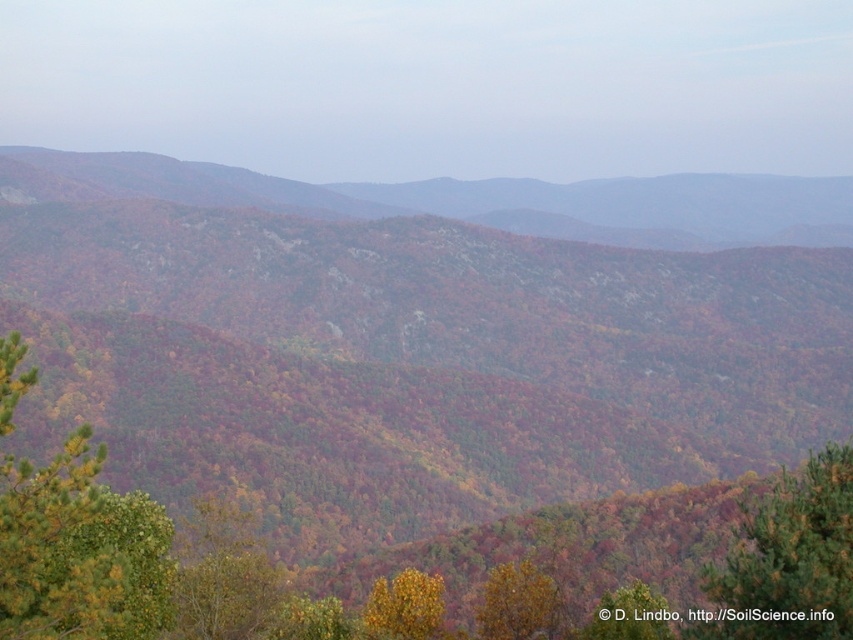
Does golden yellow pine at left have a lesser width compared to yellow matte tree at lower center?

Yes, golden yellow pine at left is thinner than yellow matte tree at lower center.

Who is more distant from viewer, (20, 524) or (367, 612)?

Point (367, 612)

At what (x,y) coordinates should I click in order to perform the action: click on golden yellow pine at left. Please return your answer as a coordinate pair (x, y). Looking at the image, I should click on (56, 548).

Who is positioned more to the right, green matte tree at lower right or green leafy tree at center?

green leafy tree at center is more to the right.

Is green matte tree at lower right to the right of green leafy tree at center from the viewer's perspective?

No, green matte tree at lower right is not to the right of green leafy tree at center.

Identify the location of green matte tree at lower right. coord(788,560).

Which is below, yellow matte tree at lower center or green leafy tree at center?

yellow matte tree at lower center

Is yellow matte tree at lower center below green leafy tree at center?

Yes.

Locate an element on the screen. This screenshot has width=853, height=640. yellow matte tree at lower center is located at coordinates (405, 605).